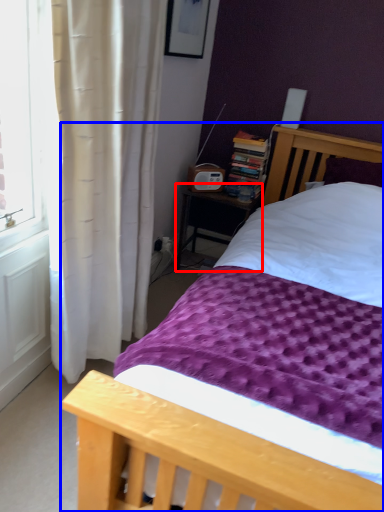
Question: Which object is closer to the camera taking this photo, nightstand (highlighted by a red box) or bed (highlighted by a blue box)?

Choices:
 (A) nightstand
 (B) bed

Answer: (B)